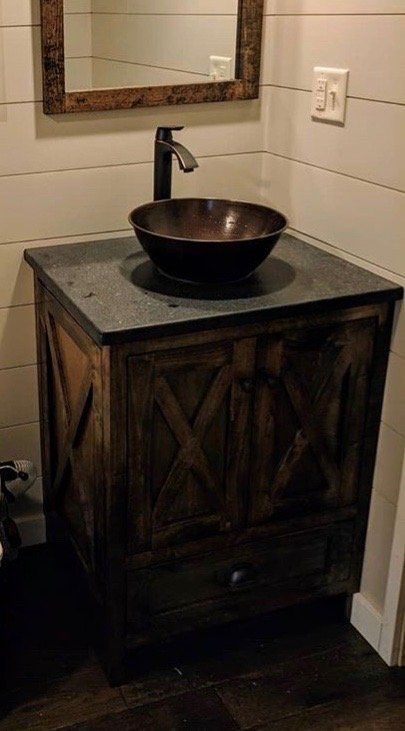
Identify the location of outlets. The image size is (405, 731). (320, 91), (213, 71).